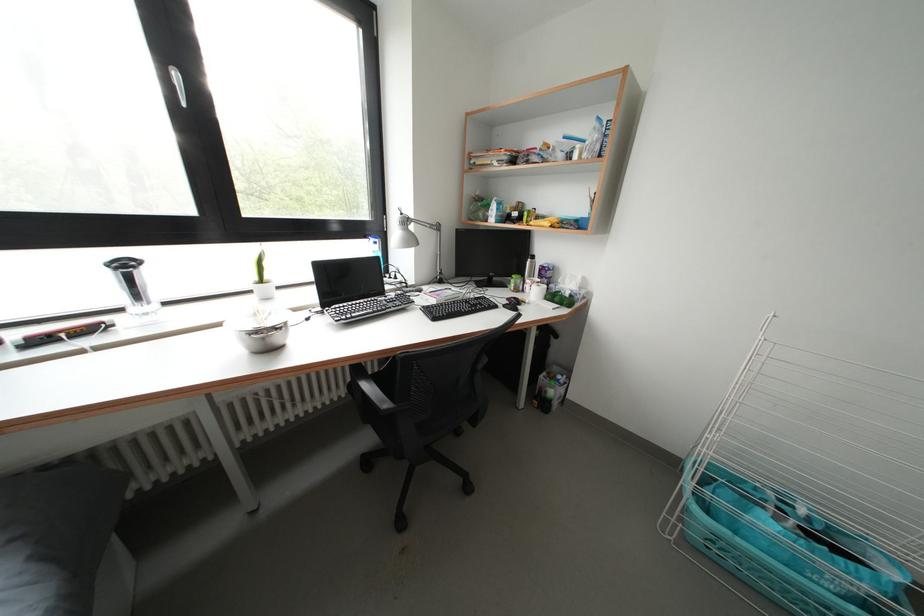
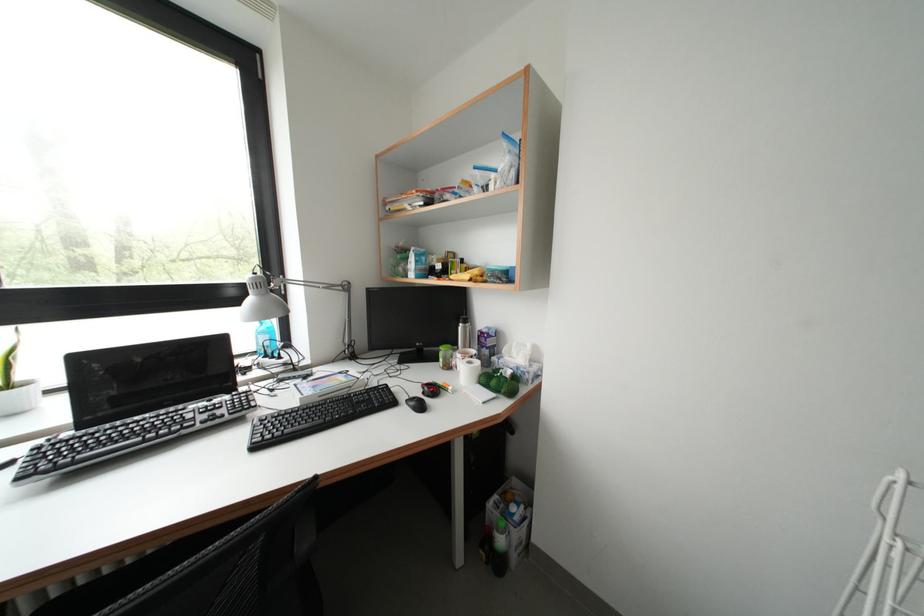
Find the pixel in the second image that matches point 494,211 in the first image.

(415, 264)